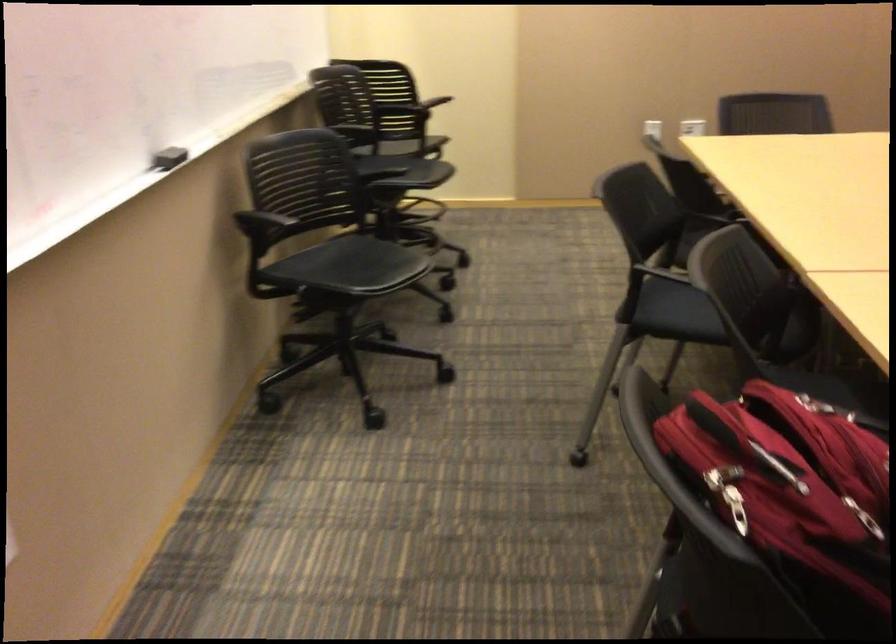
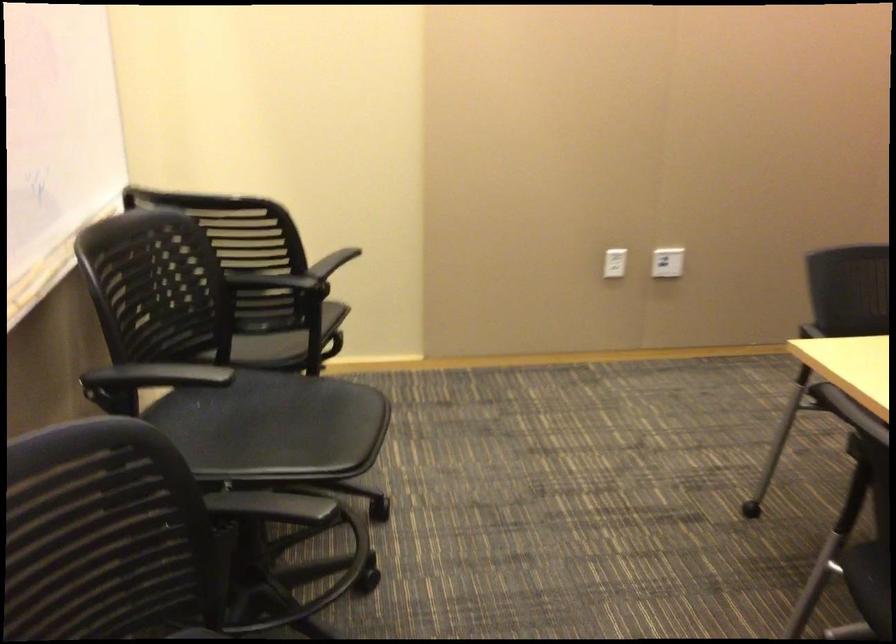
Where in the second image is the point corresponding to the point at 412,135 from the first image?

(287, 341)